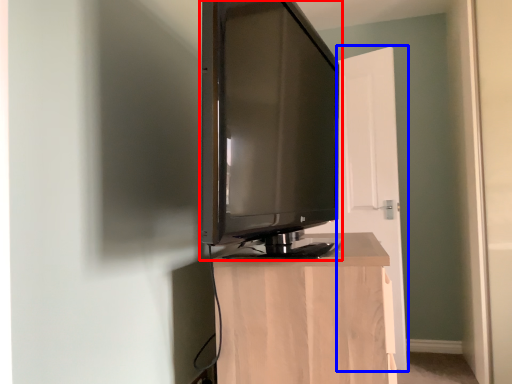
Question: Which point is further to the camera, television (highlighted by a red box) or door (highlighted by a blue box)?

Choices:
 (A) television
 (B) door

Answer: (B)